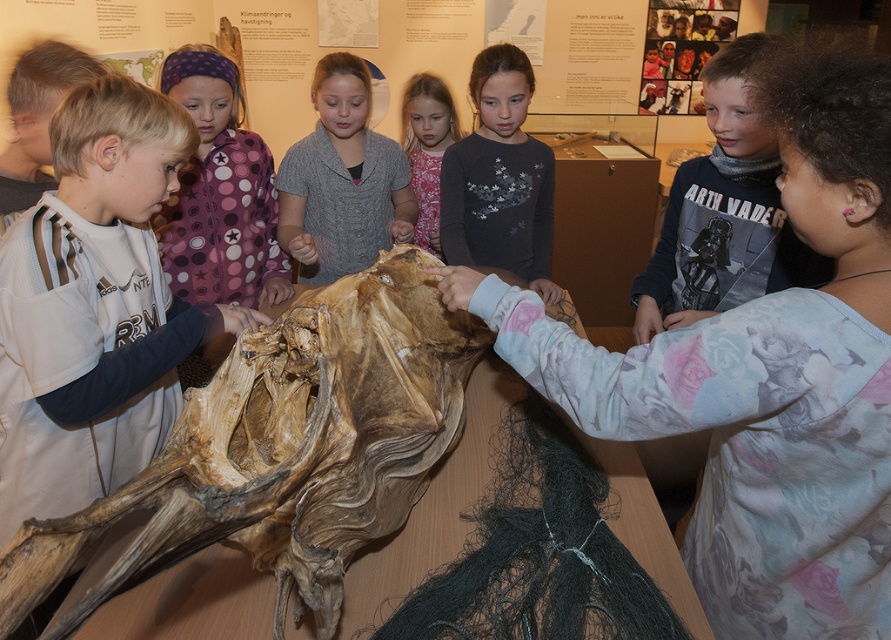
You are a photographer trying to capture a clear photo of the dark gray cotton shirt at center and the dark gray fabric shirt at center. Which of the two shirts should you focus on first to ensure both are in focus?

The dark gray cotton shirt at center is closer to the viewer than the dark gray fabric shirt at center, so you should focus on the dark gray cotton shirt at center first. This way, the depth of field will naturally include the dark gray fabric shirt at center in the background.

You are a tour guide leading a group of children at the museum. You notice two children wearing the purple dotted shirt at upper left and the gray matte sweater at center. Which child is standing more to the left side?

The purple dotted shirt at upper left is positioned on the left side of gray matte sweater at center, so the child wearing the purple dotted shirt at upper left is standing more to the left side.